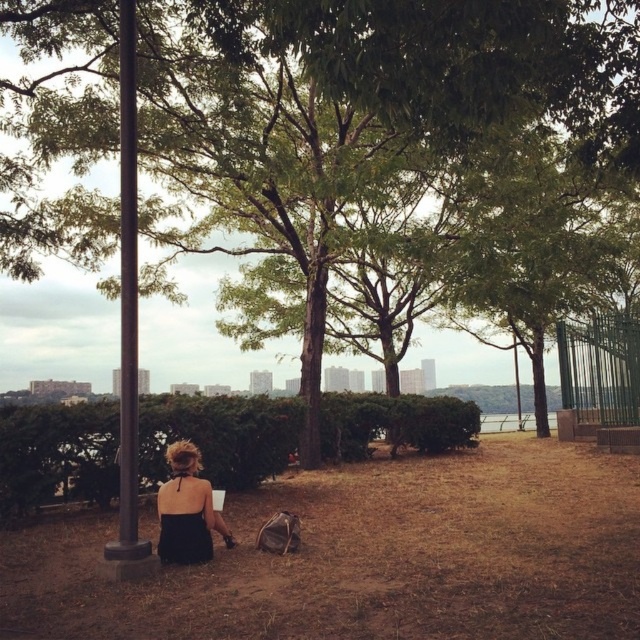
Can you confirm if black metal pole at left is smaller than black satin dress at lower left?

Actually, black metal pole at left might be larger than black satin dress at lower left.

Does black metal pole at left have a lesser width compared to black satin dress at lower left?

Indeed, black metal pole at left has a lesser width compared to black satin dress at lower left.

Is point (122, 349) in front of point (177, 524)?

Yes.

Where is `black metal pole at left`? This screenshot has height=640, width=640. black metal pole at left is located at coordinates (128, 298).